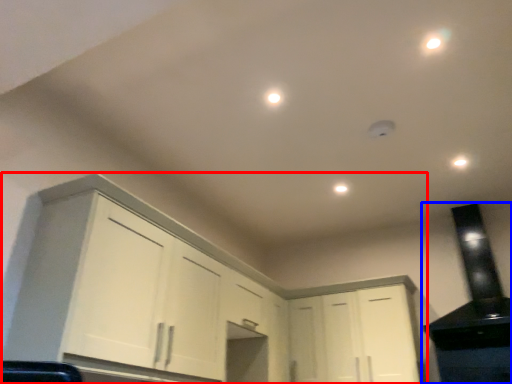
Question: Which point is further to the camera, cabinetry (highlighted by a red box) or appliance (highlighted by a blue box)?

Choices:
 (A) cabinetry
 (B) appliance

Answer: (B)